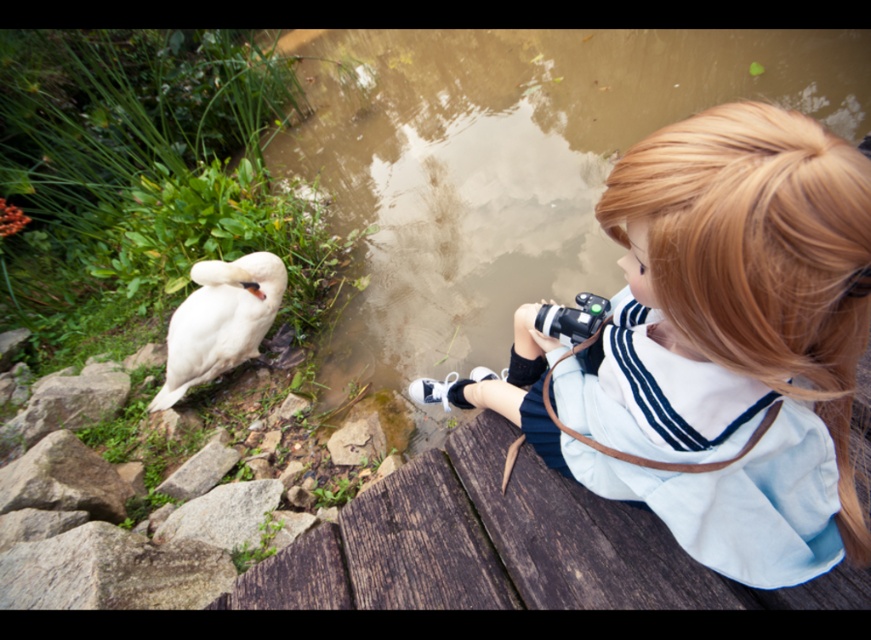
Based on the photo, how much distance is there between light blue fabric at center and black rubber camera at center?

light blue fabric at center is 13.67 inches away from black rubber camera at center.

Who is more forward, (696,246) or (575,340)?

Point (696,246) is in front.

Does point (770, 468) lie in front of point (595, 294)?

That is True.

Identify the location of light blue fabric at center. (716, 344).

Between point (632, 148) and point (161, 403), which one is positioned behind?

Positioned behind is point (161, 403).

Is light blue fabric at center taller than white matte swan at left?

No, light blue fabric at center is not taller than white matte swan at left.

Who is more forward, (564, 435) or (220, 355)?

Point (564, 435)

Where is `light blue fabric at center`? light blue fabric at center is located at coordinates (716, 344).

Can you confirm if white matte swan at left is thinner than black rubber camera at center?

No, white matte swan at left is not thinner than black rubber camera at center.

Does point (245, 262) lie behind point (592, 310)?

Yes, it is.

Locate an element on the screen. The width and height of the screenshot is (871, 640). white matte swan at left is located at coordinates (219, 321).